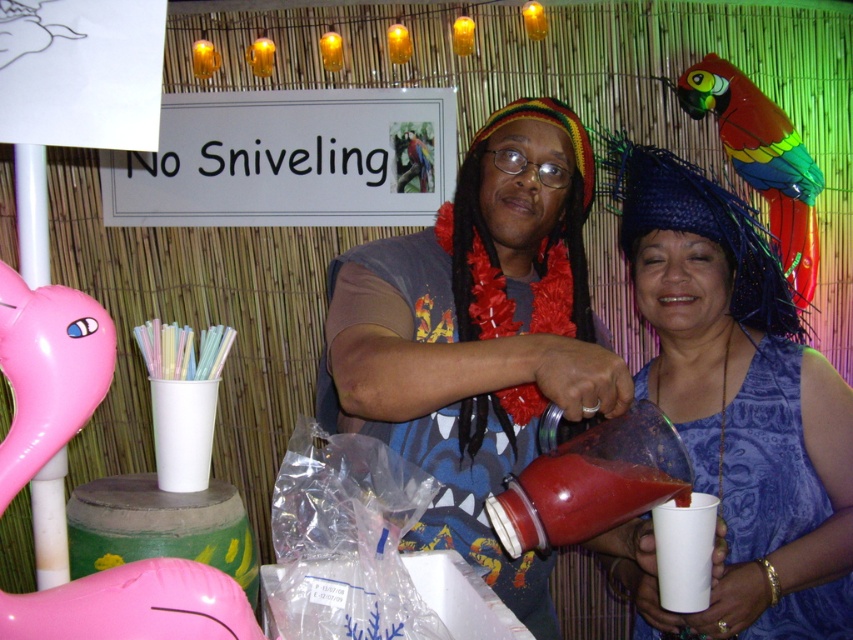
Can you confirm if blue fabric dress at center is bigger than rainbow feathered parrot at upper right?

Yes.

Which is above, blue fabric dress at center or rainbow feathered parrot at upper right?

rainbow feathered parrot at upper right is higher up.

Which is in front, point (668, 173) or point (775, 189)?

Point (668, 173) is in front.

The image size is (853, 640). What are the coordinates of `blue fabric dress at center` in the screenshot? It's located at (740, 404).

Can you confirm if matte plastic cup at center is wider than rainbow feathered parrot at upper right?

Correct, the width of matte plastic cup at center exceeds that of rainbow feathered parrot at upper right.

Which is below, matte plastic cup at center or rainbow feathered parrot at upper right?

matte plastic cup at center is lower down.

Locate an element on the screen. This screenshot has width=853, height=640. matte plastic cup at center is located at coordinates (477, 336).

Is point (352, 321) less distant than point (769, 515)?

That is True.

Does matte plastic cup at center have a smaller size compared to blue fabric dress at center?

No.

Is point (515, 579) positioned before point (689, 221)?

Yes, point (515, 579) is in front of point (689, 221).

The width and height of the screenshot is (853, 640). What are the coordinates of `matte plastic cup at center` in the screenshot? It's located at (477, 336).